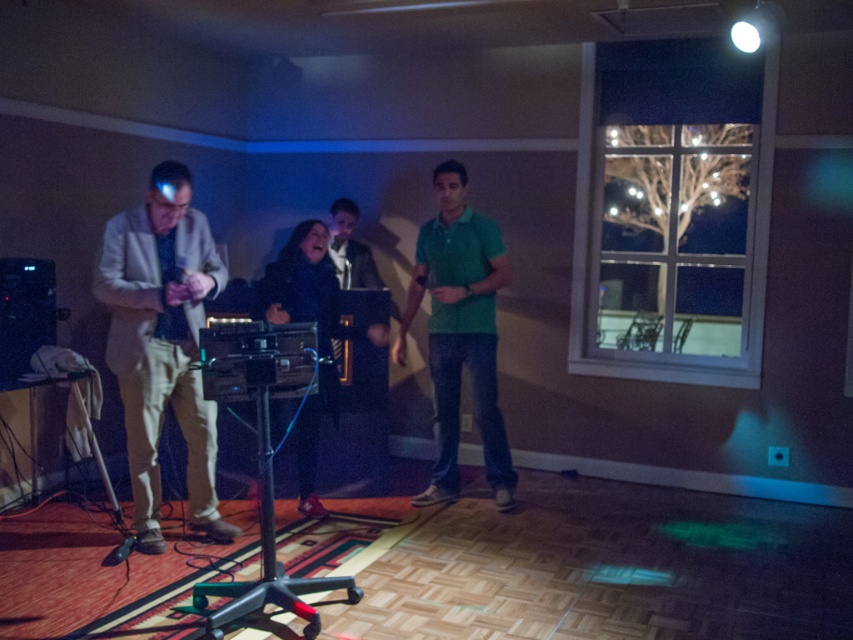
Question: Is green matte shirt at center closer to the viewer compared to velvet black coat at center?

Choices:
 (A) yes
 (B) no

Answer: (B)

Question: In this image, where is light beige fabric suit at left located relative to velvet black coat at center?

Choices:
 (A) right
 (B) left

Answer: (B)

Question: Which point appears farthest from the camera in this image?

Choices:
 (A) (312, 230)
 (B) (236, 536)

Answer: (A)

Question: Can you confirm if light beige fabric suit at left is positioned to the left of velvet black coat at center?

Choices:
 (A) yes
 (B) no

Answer: (A)

Question: Which point is farther to the camera?

Choices:
 (A) light beige fabric suit at left
 (B) green matte shirt at center
 (C) velvet black coat at center

Answer: (B)

Question: Which object appears closest to the camera in this image?

Choices:
 (A) light beige fabric suit at left
 (B) velvet black coat at center

Answer: (A)